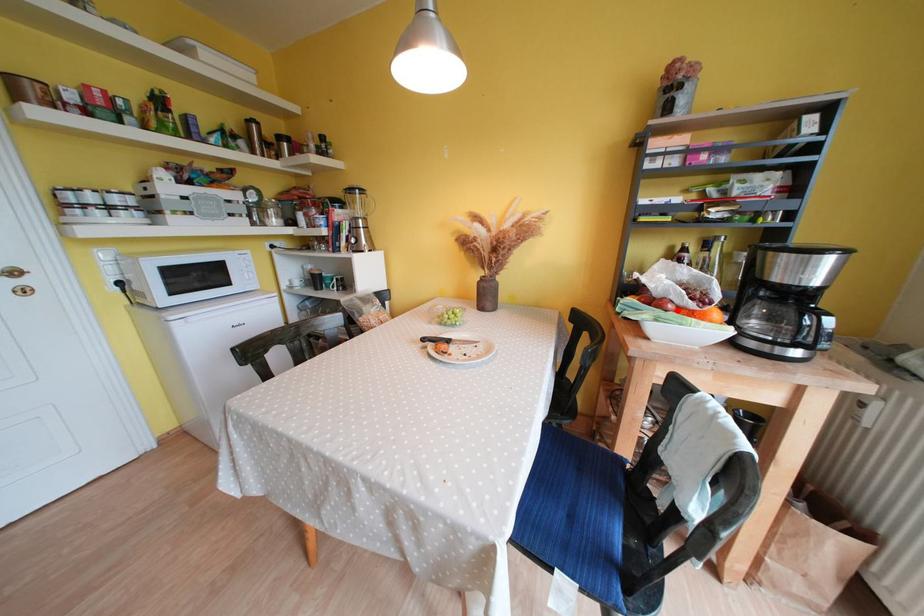
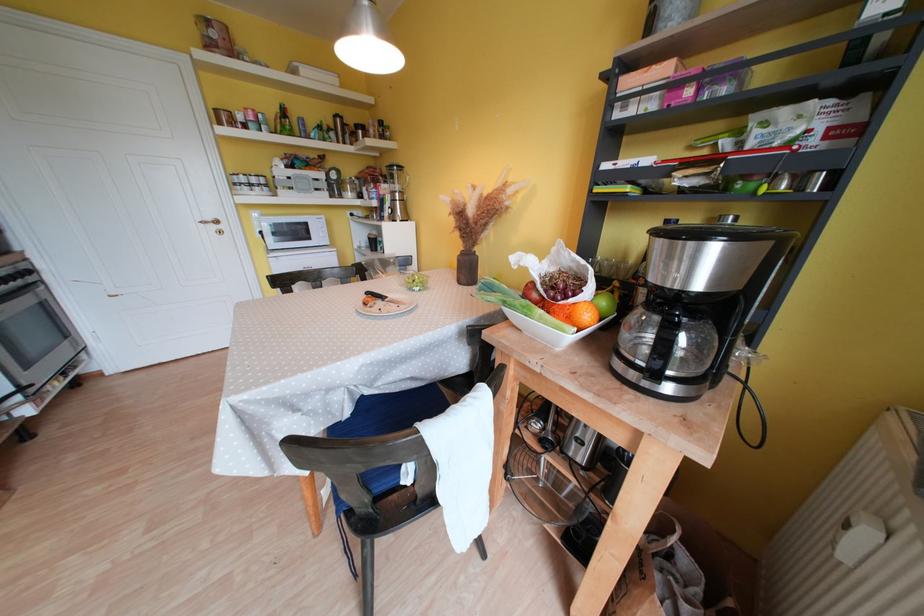
Find the pixel in the second image that matches the highlighted location in the first image.

(541, 299)